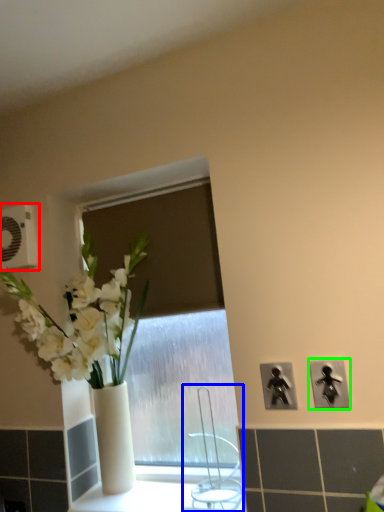
Question: Estimate the real-world distances between objects in this image. Which object is closer to electric outlet (highlighted by a red box), faucet (highlighted by a blue box) or electric outlet (highlighted by a green box)?

Choices:
 (A) faucet
 (B) electric outlet

Answer: (A)